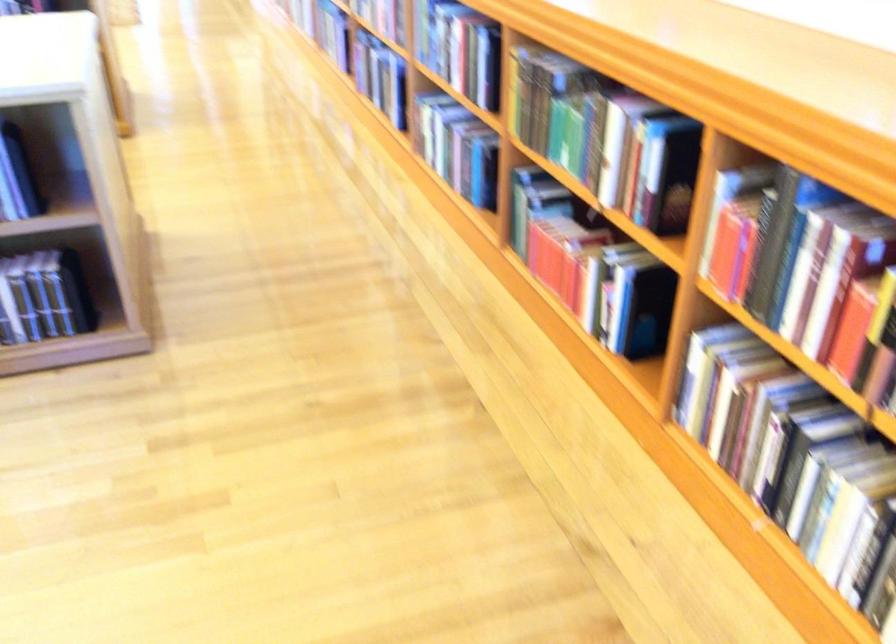
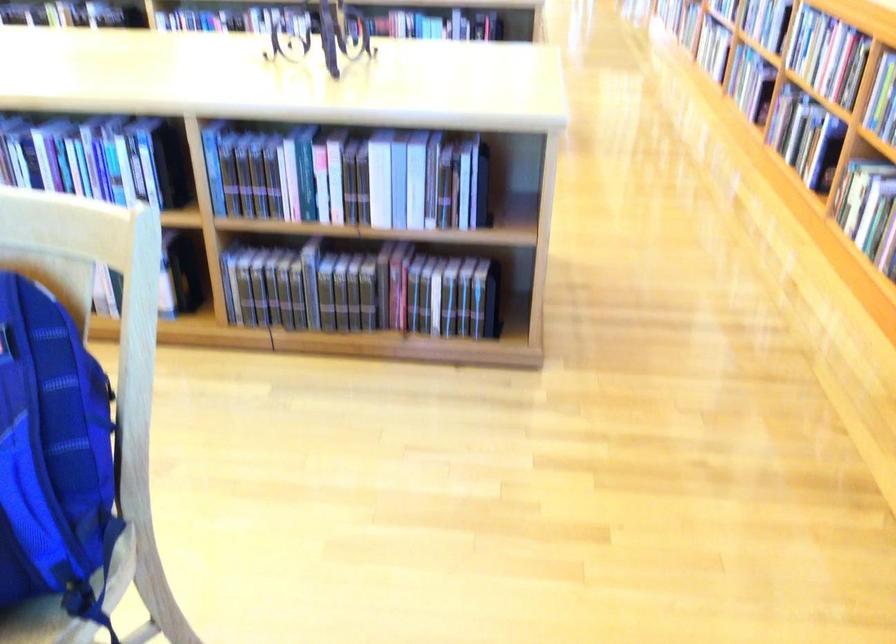
Question: Which direction would the cameraman need to move to produce the second image? Reply with the corresponding letter.

Choices:
 (A) Left
 (B) Right
 (C) Forward
 (D) Backward

Answer: (A)